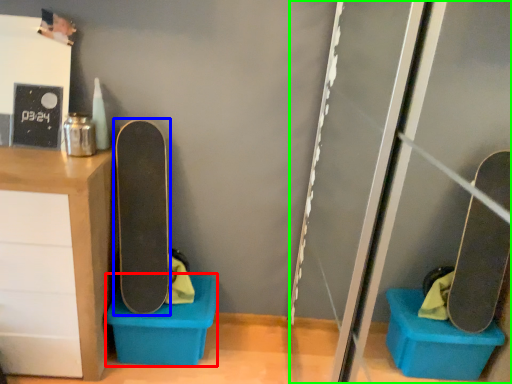
Question: Estimate the real-world distances between objects in this image. Which object is closer to storage box (highlighted by a red box), skateboard (highlighted by a blue box) or screen door (highlighted by a green box)?

Choices:
 (A) skateboard
 (B) screen door

Answer: (A)